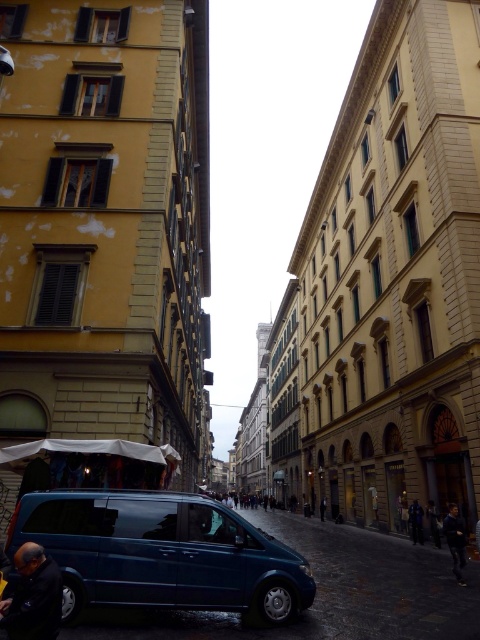
Question: Is metallic blue van at center smaller than dark blue fabric jacket at lower left?

Choices:
 (A) no
 (B) yes

Answer: (A)

Question: Which of these objects is positioned farthest from the dark blue fabric jacket at lower left?

Choices:
 (A) metallic blue van at center
 (B) shiny blue van at center

Answer: (B)

Question: Which point appears closest to the camera in this image?

Choices:
 (A) [14, 632]
 (B) [439, 564]
 (C) [201, 541]

Answer: (A)

Question: Can you confirm if shiny blue van at center is positioned to the right of dark blue fabric jacket at lower left?

Choices:
 (A) no
 (B) yes

Answer: (B)

Question: Can you confirm if metallic blue van at center is wider than dark blue fabric jacket at lower left?

Choices:
 (A) no
 (B) yes

Answer: (B)

Question: Considering the real-world distances, which object is closest to the shiny blue van at center?

Choices:
 (A) dark blue fabric jacket at lower left
 (B) metallic blue van at center

Answer: (B)